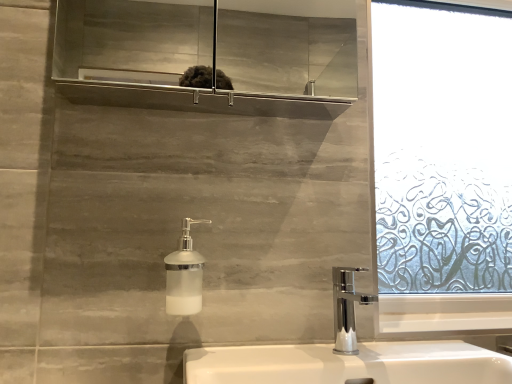
The image size is (512, 384). What do you see at coordinates (184, 275) in the screenshot?
I see `white frosted glass soap dispenser at center` at bounding box center [184, 275].

Locate an element on the screen. The width and height of the screenshot is (512, 384). white frosted glass soap dispenser at center is located at coordinates (184, 275).

The image size is (512, 384). Describe the element at coordinates (349, 364) in the screenshot. I see `white ceramic sink at lower center` at that location.

In order to click on white ceramic sink at lower center in this screenshot , I will do `click(349, 364)`.

You are a GUI agent. You are given a task and a screenshot of the screen. Output one action in this format:
    pyautogui.click(x=<x>, y=<y>)
    Task: Click on the white frosted glass soap dispenser at center
    
    Given the screenshot: What is the action you would take?
    pyautogui.click(x=184, y=275)

Considering the relative positions of white ceramic sink at lower center and white frosted glass soap dispenser at center in the image provided, is white ceramic sink at lower center to the right of white frosted glass soap dispenser at center from the viewer's perspective?

Yes, white ceramic sink at lower center is to the right of white frosted glass soap dispenser at center.

Is white ceramic sink at lower center in front of white frosted glass soap dispenser at center?

Yes, white ceramic sink at lower center is closer to the camera.

Which is less distant, (370, 355) or (176, 302)?

Positioned in front is point (176, 302).

From the image's perspective, who appears lower, white ceramic sink at lower center or white frosted glass soap dispenser at center?

white ceramic sink at lower center appears lower in the image.

From a real-world perspective, is white ceramic sink at lower center located higher than white frosted glass soap dispenser at center?

No.

Considering the relative sizes of white ceramic sink at lower center and white frosted glass soap dispenser at center in the image provided, is white ceramic sink at lower center wider than white frosted glass soap dispenser at center?

Correct, the width of white ceramic sink at lower center exceeds that of white frosted glass soap dispenser at center.

From their relative heights in the image, would you say white ceramic sink at lower center is taller or shorter than white frosted glass soap dispenser at center?

In the image, white ceramic sink at lower center appears to be taller than white frosted glass soap dispenser at center.

Considering the sizes of objects white ceramic sink at lower center and white frosted glass soap dispenser at center in the image provided, who is smaller, white ceramic sink at lower center or white frosted glass soap dispenser at center?

white frosted glass soap dispenser at center is smaller.

Could white frosted glass soap dispenser at center be considered to be inside white ceramic sink at lower center?

No.

Is the surface of white ceramic sink at lower center in direct contact with white frosted glass soap dispenser at center?

white ceramic sink at lower center and white frosted glass soap dispenser at center are not in contact.

Could you tell me if white ceramic sink at lower center is facing white frosted glass soap dispenser at center?

No.

The width and height of the screenshot is (512, 384). Find the location of `sink lying in front of the white frosted glass soap dispenser at center`. sink lying in front of the white frosted glass soap dispenser at center is located at coordinates (349, 364).

Which object is positioned more to the right, white frosted glass soap dispenser at center or white ceramic sink at lower center?

white ceramic sink at lower center.

Does white frosted glass soap dispenser at center come in front of white ceramic sink at lower center?

No, white frosted glass soap dispenser at center is further to the viewer.

Does point (197, 276) come in front of point (433, 345)?

Yes, it is.

From the image's perspective, relative to white ceramic sink at lower center, is white frosted glass soap dispenser at center above or below?

Based on their image positions, white frosted glass soap dispenser at center is located above white ceramic sink at lower center.

From a real-world perspective, who is located higher, white frosted glass soap dispenser at center or white ceramic sink at lower center?

In real-world perspective, white frosted glass soap dispenser at center is above.

Considering the relative sizes of white frosted glass soap dispenser at center and white ceramic sink at lower center in the image provided, is white frosted glass soap dispenser at center thinner than white ceramic sink at lower center?

Yes, white frosted glass soap dispenser at center is thinner than white ceramic sink at lower center.

Considering the relative sizes of white frosted glass soap dispenser at center and white ceramic sink at lower center in the image provided, is white frosted glass soap dispenser at center shorter than white ceramic sink at lower center?

Yes.

Considering the relative sizes of white frosted glass soap dispenser at center and white ceramic sink at lower center in the image provided, is white frosted glass soap dispenser at center smaller than white ceramic sink at lower center?

Yes.

Would you say white frosted glass soap dispenser at center is inside or outside white ceramic sink at lower center?

white frosted glass soap dispenser at center cannot be found inside white ceramic sink at lower center.

In the scene shown: Is the surface of white frosted glass soap dispenser at center in direct contact with white ceramic sink at lower center?

No, white frosted glass soap dispenser at center is not with white ceramic sink at lower center.

Is white frosted glass soap dispenser at center turned away from white ceramic sink at lower center?

No, white frosted glass soap dispenser at center is not facing the opposite direction of white ceramic sink at lower center.

Identify the location of soap dispenser above the white ceramic sink at lower center (from the image's perspective). (184, 275).

Identify the location of soap dispenser that is behind the white ceramic sink at lower center. This screenshot has height=384, width=512. (184, 275).

At what (x,y) coordinates should I click in order to perform the action: click on sink in front of the white frosted glass soap dispenser at center. Please return your answer as a coordinate pair (x, y). This screenshot has width=512, height=384. Looking at the image, I should click on (349, 364).